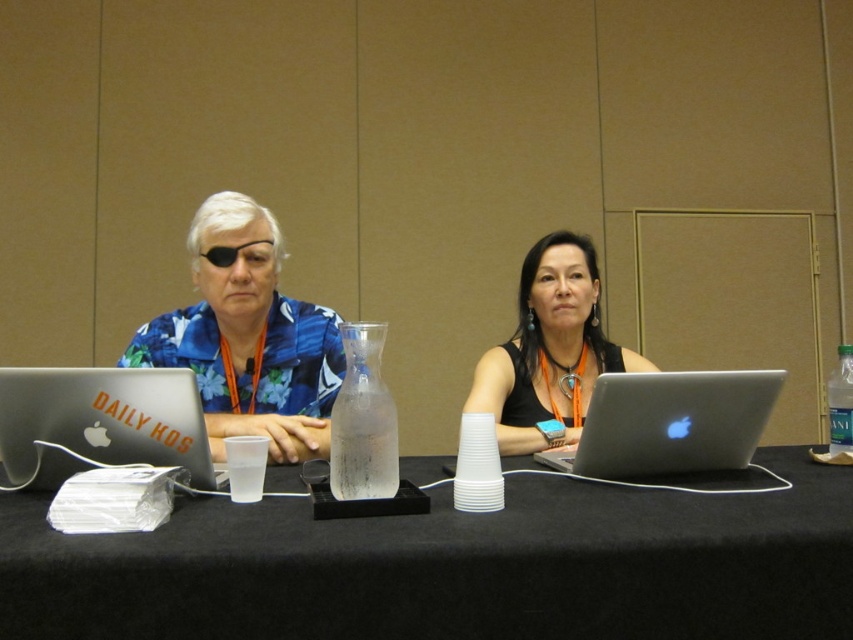
Question: Can you confirm if clear glass carafe at center is positioned above clear glass bottle at right?

Choices:
 (A) no
 (B) yes

Answer: (B)

Question: Is black matte laptop at center above silver metallic laptop at center?

Choices:
 (A) yes
 (B) no

Answer: (A)

Question: Which of the following is the closest to the observer?

Choices:
 (A) (296, 403)
 (B) (611, 419)
 (C) (566, 429)

Answer: (B)

Question: Among these objects, which one is farthest from the camera?

Choices:
 (A) black matte laptop at center
 (B) matte silver laptop at left
 (C) blue floral shirt at left
 (D) black matte table at center

Answer: (A)

Question: Does black matte table at center appear on the right side of silver metallic laptop at center?

Choices:
 (A) no
 (B) yes

Answer: (A)

Question: Which point is closer to the camera?

Choices:
 (A) clear glass carafe at center
 (B) black matte table at center
 (C) clear glass bottle at right

Answer: (B)